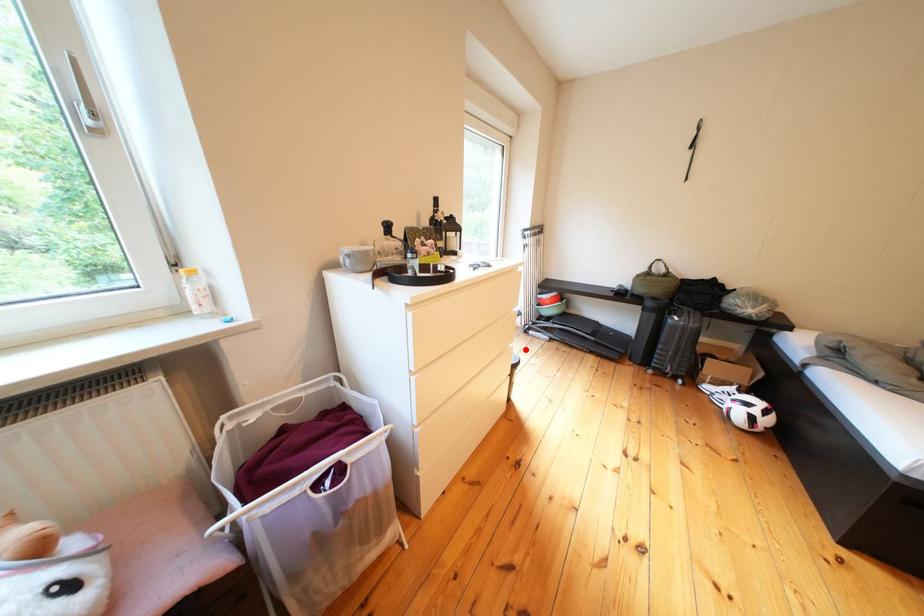
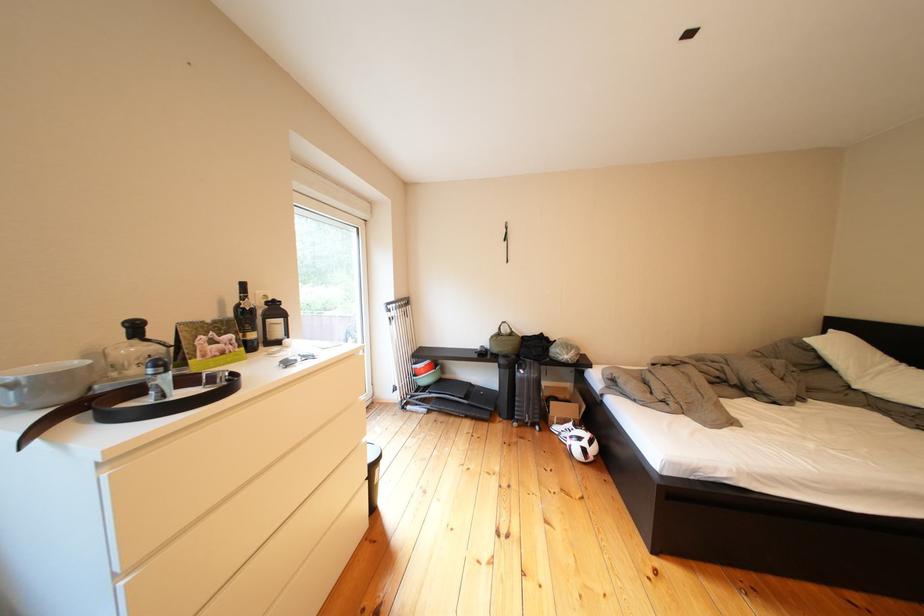
The point at the highlighted location is marked in the first image. Where is the corresponding point in the second image?

(378, 445)